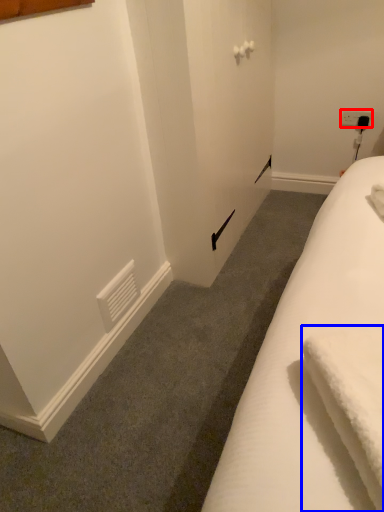
Question: Which point is closer to the camera, electric outlet (highlighted by a red box) or bath towel (highlighted by a blue box)?

Choices:
 (A) electric outlet
 (B) bath towel

Answer: (B)